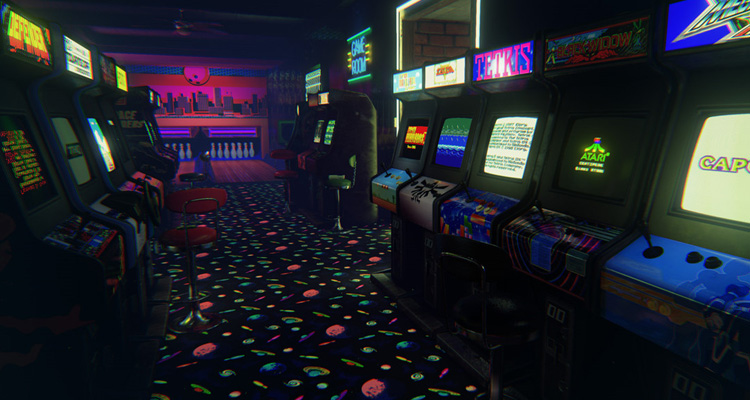
You are a GUI agent. You are given a task and a screenshot of the screen. Output one action in this format:
    pyautogui.click(x=<x>, y=<y>)
    Task: Click on the seat
    
    Given the screenshot: What is the action you would take?
    201,230, 344,184, 283,173, 194,173